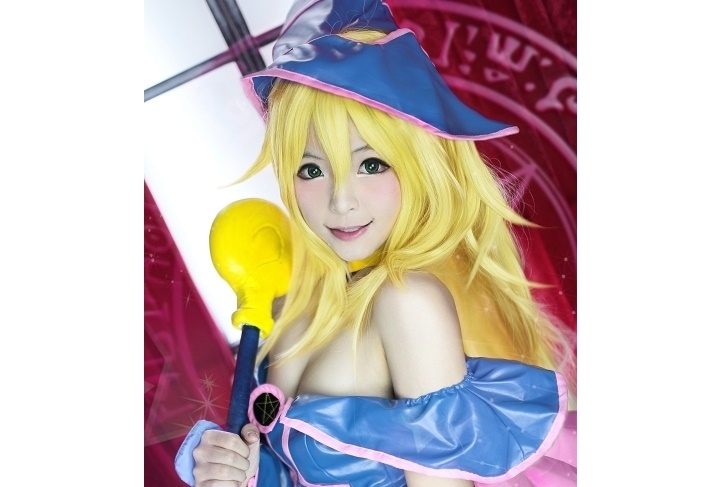
Identify the location of glass window panel. The height and width of the screenshot is (487, 721). (220, 109), (181, 34), (262, 18), (265, 52).